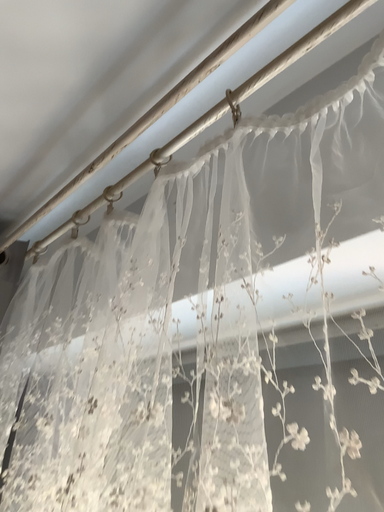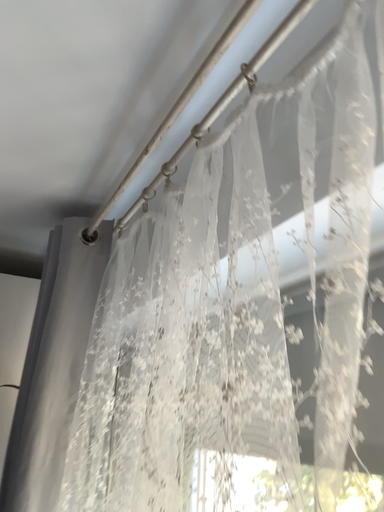
Question: How did the camera likely rotate when shooting the video?

Choices:
 (A) rotated right
 (B) rotated left

Answer: (B)